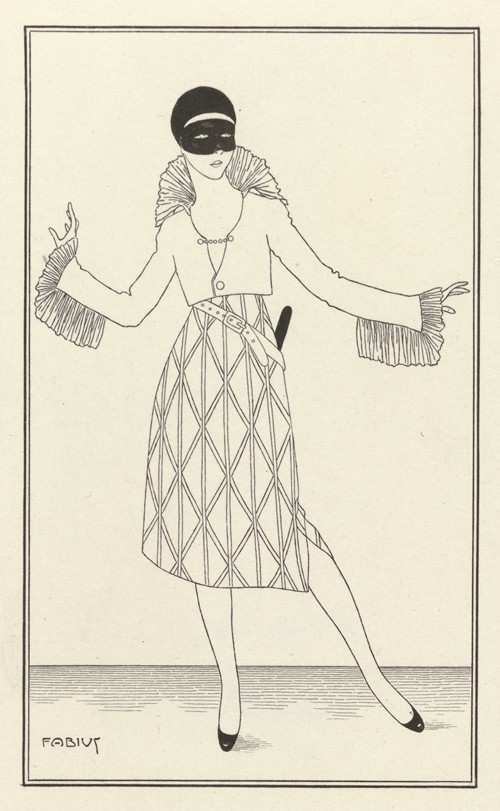
Locate an element on the screen. The image size is (500, 811). wall is located at coordinates (430, 507).